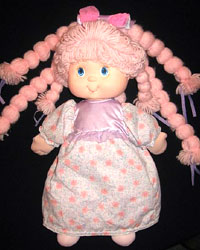
Find the location of a particular element. This screenshot has width=200, height=250. doll is located at coordinates (97, 155).